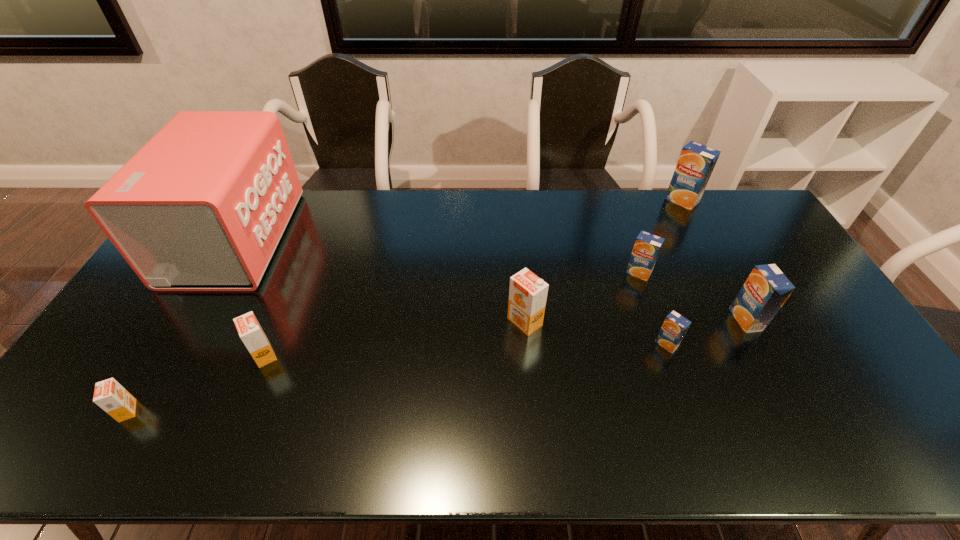
Identify which object is located as the fourth nearest to the pink box. Please provide its 2D coordinates. Your answer should be formatted as a tuple, i.e. [(x, y)], where the tuple contains the x and y coordinates of a point satisfying the conditions above.

[(647, 246)]

The width and height of the screenshot is (960, 540). Find the location of `orange juice that is the sixth closest to the box`. orange juice that is the sixth closest to the box is located at coordinates (696, 162).

What are the coordinates of `orange juice that can be found as the sixth closest to the box` in the screenshot? It's located at (696, 162).

Identify which blue orange_juice is the second closest to the second orange juice from left to right. Please provide its 2D coordinates. Your answer should be formatted as a tuple, i.e. [(x, y)], where the tuple contains the x and y coordinates of a point satisfying the conditions above.

[(647, 246)]

Locate which blue orange_juice ranks fourth in proximity to the biggest orange orange juice. Please provide its 2D coordinates. Your answer should be formatted as a tuple, i.e. [(x, y)], where the tuple contains the x and y coordinates of a point satisfying the conditions above.

[(696, 162)]

In order to click on orange orange juice that is the third closest to the nearest blue orange_juice in this screenshot , I will do [x=114, y=399].

Where is `orange orange juice that can be found as the second closest to the leftmost orange orange juice`? Image resolution: width=960 pixels, height=540 pixels. orange orange juice that can be found as the second closest to the leftmost orange orange juice is located at coordinates (527, 293).

Identify the location of vacant space that satisfies the following two spatial constraints: 1. on the surface of the sixth nearest orange juice where the text is embossed; 2. on the left side of the box. The width and height of the screenshot is (960, 540). (215, 273).

The width and height of the screenshot is (960, 540). I want to click on vacant space that satisfies the following two spatial constraints: 1. on the back side of the leftmost orange orange juice; 2. on the right side of the farthest orange orange juice, so click(x=180, y=322).

The height and width of the screenshot is (540, 960). Find the location of `free space in the image that satisfies the following two spatial constraints: 1. on the surface of the second orange orange juice from left to right where the text is embossed; 2. on the left side of the tallest object`. free space in the image that satisfies the following two spatial constraints: 1. on the surface of the second orange orange juice from left to right where the text is embossed; 2. on the left side of the tallest object is located at coordinates (167, 355).